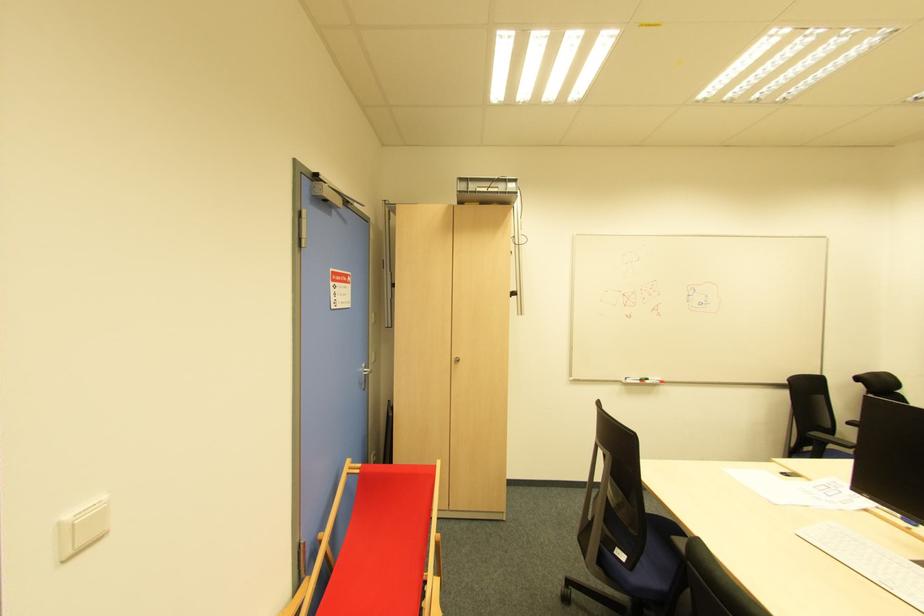
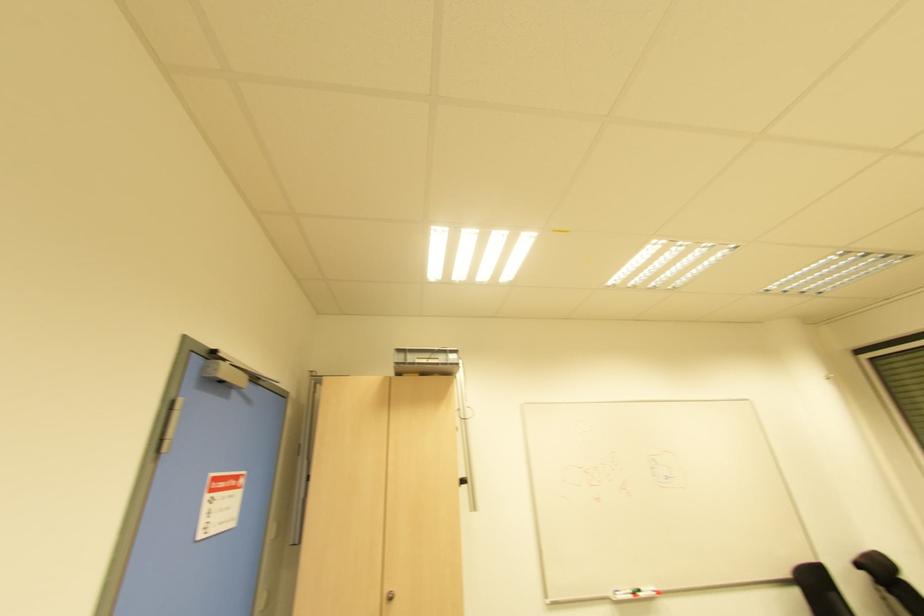
Question: The images are taken continuously from a first-person perspective. In which direction are you moving?

Choices:
 (A) Left
 (B) Right
 (C) Forward
 (D) Backward

Answer: (C)